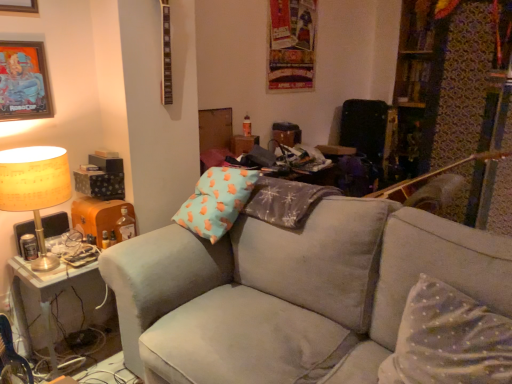
The height and width of the screenshot is (384, 512). What do you see at coordinates (24, 81) in the screenshot? I see `metallic silver picture frame at upper left, which ranks as the second picture frame in top-to-bottom order` at bounding box center [24, 81].

What do you see at coordinates (45, 295) in the screenshot? I see `metallic brass table at lower left` at bounding box center [45, 295].

Measure the distance between metallic brass table at lower left and camera.

The distance of metallic brass table at lower left from camera is 1.79 meters.

This screenshot has width=512, height=384. I want to click on suede gray couch at center, so click(292, 292).

Image resolution: width=512 pixels, height=384 pixels. Find the location of `metallic silver picture frame at upper left, which is the 1th picture frame in bottom-to-top order`. metallic silver picture frame at upper left, which is the 1th picture frame in bottom-to-top order is located at coordinates (24, 81).

In the scene shown: Which object is more forward, suede gray couch at center or white dotted fabric pillow at lower right?

suede gray couch at center is in front.

From a real-world perspective, does suede gray couch at center stand above white dotted fabric pillow at lower right?

No, from a real-world perspective, suede gray couch at center is not over white dotted fabric pillow at lower right

Does suede gray couch at center have a greater width compared to white dotted fabric pillow at lower right?

Yes.

Based on the photo, in the image, is suede gray couch at center on the left side or the right side of white dotted fabric pillow at lower right?

Clearly, suede gray couch at center is on the left of white dotted fabric pillow at lower right in the image.

You are a GUI agent. You are given a task and a screenshot of the screen. Output one action in this format:
    pyautogui.click(x=<x>, y=<y>)
    Task: Click on the pillow on the right of suede gray couch at center
    
    Given the screenshot: What is the action you would take?
    pyautogui.click(x=448, y=340)

Between white dotted fabric pillow at lower right and suede gray couch at center, which one has less height?

Standing shorter between the two is white dotted fabric pillow at lower right.

Can you see white dotted fabric pillow at lower right touching suede gray couch at center?

white dotted fabric pillow at lower right and suede gray couch at center are not in contact.

Can you confirm if white dotted fabric pillow at lower right is bigger than suede gray couch at center?

Incorrect, white dotted fabric pillow at lower right is not larger than suede gray couch at center.

Considering the sizes of objects white dotted fabric pillow at lower right and metallic picture frame at upper left, arranged as the 2th picture frame when ordered from the bottom, in the image provided, who is thinner, white dotted fabric pillow at lower right or metallic picture frame at upper left, arranged as the 2th picture frame when ordered from the bottom,?

Thinner between the two is metallic picture frame at upper left, arranged as the 2th picture frame when ordered from the bottom.

Is point (401, 368) closer to camera compared to point (30, 12)?

Yes.

Is white dotted fabric pillow at lower right smaller than metallic picture frame at upper left, the 1th picture frame from the top?

No.

Which is correct: white dotted fabric pillow at lower right is inside metallic picture frame at upper left, arranged as the 2th picture frame when ordered from the bottom, or outside of it?

white dotted fabric pillow at lower right is not enclosed by metallic picture frame at upper left, arranged as the 2th picture frame when ordered from the bottom.

How different are the orientations of metallic picture frame at upper left, the 1th picture frame from the top, and suede gray couch at center in degrees?

87 degrees separate the facing orientations of metallic picture frame at upper left, the 1th picture frame from the top, and suede gray couch at center.

From the image's perspective, which is above, metallic picture frame at upper left, arranged as the 2th picture frame when ordered from the bottom, or suede gray couch at center?

From the image's view, metallic picture frame at upper left, arranged as the 2th picture frame when ordered from the bottom, is above.

Consider the image. Considering the sizes of metallic picture frame at upper left, the 1th picture frame from the top, and suede gray couch at center in the image, is metallic picture frame at upper left, the 1th picture frame from the top, wider or thinner than suede gray couch at center?

In the image, metallic picture frame at upper left, the 1th picture frame from the top, appears to be more narrow than suede gray couch at center.

Is metallic picture frame at upper left, the 1th picture frame from the top, placed right next to suede gray couch at center?

metallic picture frame at upper left, the 1th picture frame from the top, is not next to suede gray couch at center, and they're not touching.

From the image's perspective, is white dotted fabric pillow at lower right positioned above or below metallic silver picture frame at upper left, which is the 1th picture frame in bottom-to-top order?

white dotted fabric pillow at lower right is situated lower than metallic silver picture frame at upper left, which is the 1th picture frame in bottom-to-top order, in the image.

In the scene shown: Is white dotted fabric pillow at lower right completely or partially outside of metallic silver picture frame at upper left, which ranks as the second picture frame in top-to-bottom order?

Yes, white dotted fabric pillow at lower right is outside of metallic silver picture frame at upper left, which ranks as the second picture frame in top-to-bottom order.

Is white dotted fabric pillow at lower right positioned far away from metallic silver picture frame at upper left, which is the 1th picture frame in bottom-to-top order?

Yes, white dotted fabric pillow at lower right is far from metallic silver picture frame at upper left, which is the 1th picture frame in bottom-to-top order.

Can you confirm if white dotted fabric pillow at lower right is shorter than metallic silver picture frame at upper left, which is the 1th picture frame in bottom-to-top order?

Incorrect, the height of white dotted fabric pillow at lower right does not fall short of that of metallic silver picture frame at upper left, which is the 1th picture frame in bottom-to-top order.

Considering the sizes of objects metallic picture frame at upper left, arranged as the 2th picture frame when ordered from the bottom, and matte yellow fabric lampshade at left in the image provided, who is shorter, metallic picture frame at upper left, arranged as the 2th picture frame when ordered from the bottom, or matte yellow fabric lampshade at left?

metallic picture frame at upper left, arranged as the 2th picture frame when ordered from the bottom.

From a real-world perspective, is metallic picture frame at upper left, the 1th picture frame from the top, positioned under matte yellow fabric lampshade at left based on gravity?

Actually, metallic picture frame at upper left, the 1th picture frame from the top, is physically above matte yellow fabric lampshade at left in the real world.

Can you tell me how much metallic picture frame at upper left, the 1th picture frame from the top, and matte yellow fabric lampshade at left differ in facing direction?

The angular difference between metallic picture frame at upper left, the 1th picture frame from the top, and matte yellow fabric lampshade at left is 0.0032 degrees.

Considering the positions of objects metallic picture frame at upper left, arranged as the 2th picture frame when ordered from the bottom, and matte yellow fabric lampshade at left in the image provided, who is more to the left, metallic picture frame at upper left, arranged as the 2th picture frame when ordered from the bottom, or matte yellow fabric lampshade at left?

metallic picture frame at upper left, arranged as the 2th picture frame when ordered from the bottom.

From their relative heights in the image, would you say metallic brass table at lower left is taller or shorter than metallic picture frame at upper left, the 1th picture frame from the top?

metallic brass table at lower left is taller than metallic picture frame at upper left, the 1th picture frame from the top.

From the image's perspective, between metallic brass table at lower left and metallic picture frame at upper left, the 1th picture frame from the top, who is located below?

metallic brass table at lower left.

Between metallic brass table at lower left and metallic picture frame at upper left, the 1th picture frame from the top, which one has larger width?

metallic brass table at lower left is wider.

How many degrees apart are the facing directions of metallic brass table at lower left and metallic picture frame at upper left, arranged as the 2th picture frame when ordered from the bottom?

The facing directions of metallic brass table at lower left and metallic picture frame at upper left, arranged as the 2th picture frame when ordered from the bottom, are 0.00328 degrees apart.

The image size is (512, 384). Find the location of `studio couch located in front of the white dotted fabric pillow at lower right`. studio couch located in front of the white dotted fabric pillow at lower right is located at coordinates (292, 292).

Find the location of a particular element. pillow on the right of the suede gray couch at center is located at coordinates (448, 340).

Looking at the image, which one is located closer to suede gray couch at center, metallic silver picture frame at upper left, which ranks as the second picture frame in top-to-bottom order, or white dotted fabric pillow at lower right?

The object closer to suede gray couch at center is white dotted fabric pillow at lower right.

When comparing their distances from matte yellow fabric lampshade at left, does white dotted fabric pillow at lower right or metallic picture frame at upper left, arranged as the 2th picture frame when ordered from the bottom, seem closer?

metallic picture frame at upper left, arranged as the 2th picture frame when ordered from the bottom.

Based on their spatial positions, is metallic picture frame at upper left, arranged as the 2th picture frame when ordered from the bottom, or metallic brass table at lower left further from suede gray couch at center?

metallic picture frame at upper left, arranged as the 2th picture frame when ordered from the bottom, is further to suede gray couch at center.

Considering their positions, is metallic silver picture frame at upper left, which ranks as the second picture frame in top-to-bottom order, positioned further to metallic brass table at lower left than metallic picture frame at upper left, the 1th picture frame from the top?

metallic picture frame at upper left, the 1th picture frame from the top.

Estimate the real-world distances between objects in this image. Which object is further from matte yellow fabric lampshade at left, metallic brass table at lower left or metallic picture frame at upper left, the 1th picture frame from the top?

Based on the image, metallic picture frame at upper left, the 1th picture frame from the top, appears to be further to matte yellow fabric lampshade at left.

Estimate the real-world distances between objects in this image. Which object is closer to white dotted fabric pillow at lower right, metallic picture frame at upper left, the 1th picture frame from the top, or matte yellow fabric lampshade at left?

matte yellow fabric lampshade at left lies closer to white dotted fabric pillow at lower right than the other object.

From the image, which object appears to be farther from metallic brass table at lower left, white dotted fabric pillow at lower right or metallic picture frame at upper left, the 1th picture frame from the top?

Based on the image, white dotted fabric pillow at lower right appears to be further to metallic brass table at lower left.

When comparing their distances from metallic brass table at lower left, does metallic silver picture frame at upper left, which ranks as the second picture frame in top-to-bottom order, or suede gray couch at center seem further?

metallic silver picture frame at upper left, which ranks as the second picture frame in top-to-bottom order, is positioned further to the anchor metallic brass table at lower left.

I want to click on studio couch between metallic picture frame at upper left, arranged as the 2th picture frame when ordered from the bottom, and metallic brass table at lower left, in the vertical direction, so click(292, 292).

Where is `table lamp between metallic picture frame at upper left, arranged as the 2th picture frame when ordered from the bottom, and metallic brass table at lower left in the up-down direction`? This screenshot has height=384, width=512. table lamp between metallic picture frame at upper left, arranged as the 2th picture frame when ordered from the bottom, and metallic brass table at lower left in the up-down direction is located at coordinates (35, 188).

Where is `table lamp situated between metallic silver picture frame at upper left, which ranks as the second picture frame in top-to-bottom order, and suede gray couch at center from left to right`? The height and width of the screenshot is (384, 512). table lamp situated between metallic silver picture frame at upper left, which ranks as the second picture frame in top-to-bottom order, and suede gray couch at center from left to right is located at coordinates tap(35, 188).

Where is `studio couch between metallic silver picture frame at upper left, which ranks as the second picture frame in top-to-bottom order, and white dotted fabric pillow at lower right from left to right`? The image size is (512, 384). studio couch between metallic silver picture frame at upper left, which ranks as the second picture frame in top-to-bottom order, and white dotted fabric pillow at lower right from left to right is located at coordinates (292, 292).